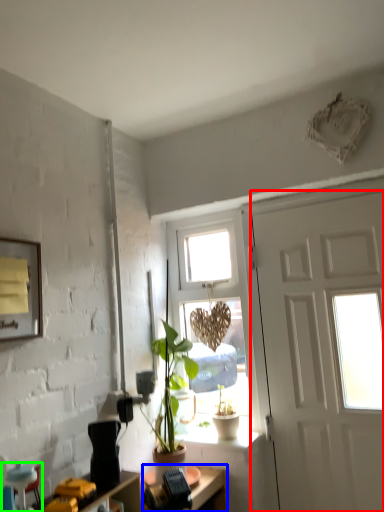
Question: Which object is positioned closest to door (highlighted by a red box)? Select from desk (highlighted by a blue box) and armchair (highlighted by a green box).

Choices:
 (A) desk
 (B) armchair

Answer: (A)